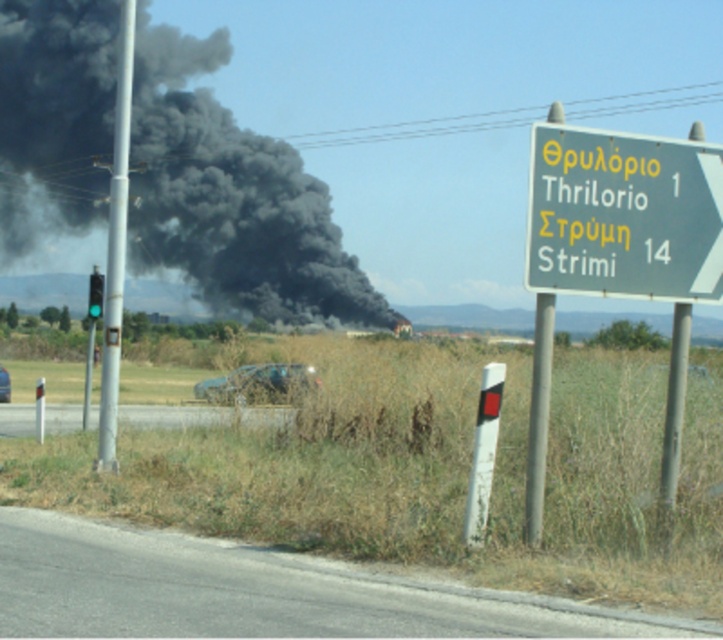
You are a driver approaching the road sign on the right. You notice the black smoke at left and the gray asphalt road at lower center. Which of these two objects appears larger in the scene?

The black smoke at left is bigger than the gray asphalt road at lower center, so the black smoke at left appears larger in the scene.

You are a delivery driver passing by a road sign. You notice a point marked at coordinates (617,253) on the sign. Where exactly is this point located on the green metallic sign at upper right?

The point marked at coordinates (617,253) is located on the green metallic sign at upper right.

You are a driver approaching the green metallic sign at upper right. What are the destinations listed on the sign?

The destinations listed on the green metallic sign at upper right are Thrilorio, Strimi, and the distance 14.